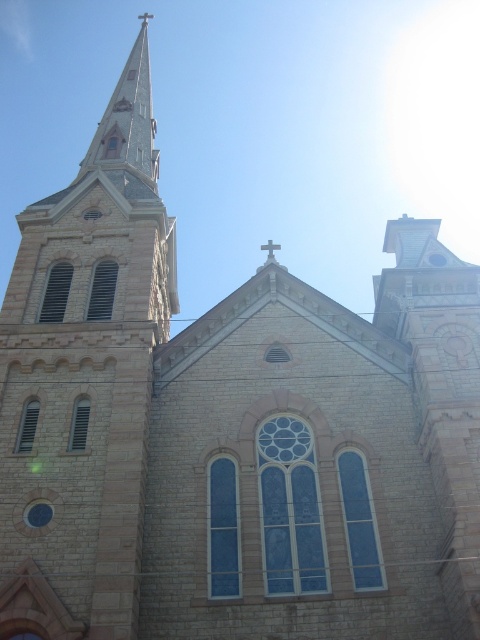
Question: Can you confirm if light gray stone steeple at upper left is thinner than metallic cross at upper center?

Choices:
 (A) yes
 (B) no

Answer: (B)

Question: Which point is closer to the camera?

Choices:
 (A) metallic cross at center
 (B) light gray stone steeple at upper left
 (C) metallic cross at upper center

Answer: (B)

Question: Can you confirm if light gray stone steeple at upper left is positioned to the right of metallic cross at center?

Choices:
 (A) yes
 (B) no

Answer: (B)

Question: Which object is farther from the camera taking this photo?

Choices:
 (A) light gray stone steeple at upper left
 (B) metallic cross at upper center

Answer: (B)

Question: Which object is positioned closest to the metallic cross at center?

Choices:
 (A) light gray stone steeple at upper left
 (B) metallic cross at upper center

Answer: (A)

Question: Considering the relative positions of light gray stone steeple at upper left and metallic cross at upper center in the image provided, where is light gray stone steeple at upper left located with respect to metallic cross at upper center?

Choices:
 (A) below
 (B) above

Answer: (A)